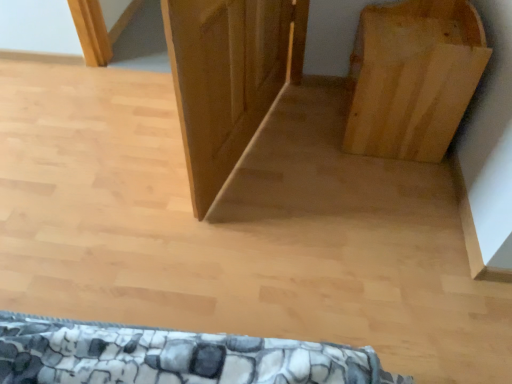
Where is `vacant space that is in between natural wood bookshelf at right and wooden door at center`? vacant space that is in between natural wood bookshelf at right and wooden door at center is located at coordinates (310, 152).